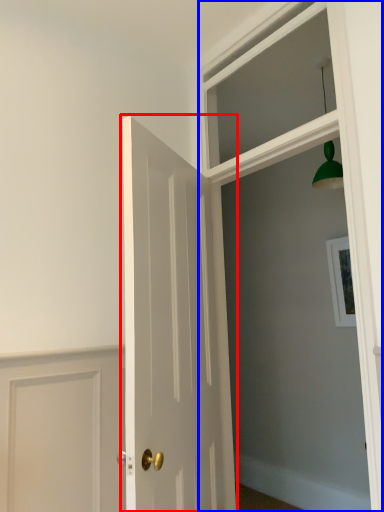
Question: Which object appears farthest to the camera in this image, door (highlighted by a red box) or window frame (highlighted by a blue box)?

Choices:
 (A) door
 (B) window frame

Answer: (B)